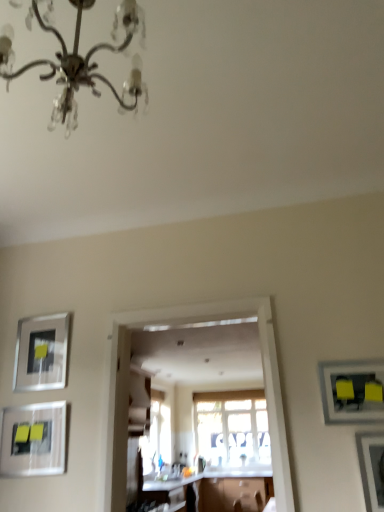
Question: Is translucent glass window at center spatially inside metallic silver picture frame at lower right, which is counted as the 4th picture frame, starting from the back, or outside of it?

Choices:
 (A) outside
 (B) inside

Answer: (A)

Question: In terms of width, does translucent glass window at center look wider or thinner when compared to metallic silver picture frame at lower right, which ranks as the 4th picture frame in left-to-right order?

Choices:
 (A) wide
 (B) thin

Answer: (B)

Question: Which object is positioned farthest from the silver metallic picture frame at left, the 1th picture frame viewed from the back?

Choices:
 (A) white glossy countertop at center
 (B) matte black picture frame at right, which is the third picture frame in back-to-front order
 (C) translucent glass window at center
 (D) metallic silver picture frame at lower right, acting as the first picture frame starting from the front
 (E) white glossy table at center

Answer: (C)

Question: Which object is positioned closest to the translucent glass window at center?

Choices:
 (A) metallic silver picture frame at lower right, acting as the first picture frame starting from the front
 (B) white glossy countertop at center
 (C) matte silver picture frame at lower left, the third picture frame from the right
 (D) silver metallic chandelier at upper center
 (E) matte black picture frame at right, the second picture frame in the front-to-back sequence

Answer: (B)